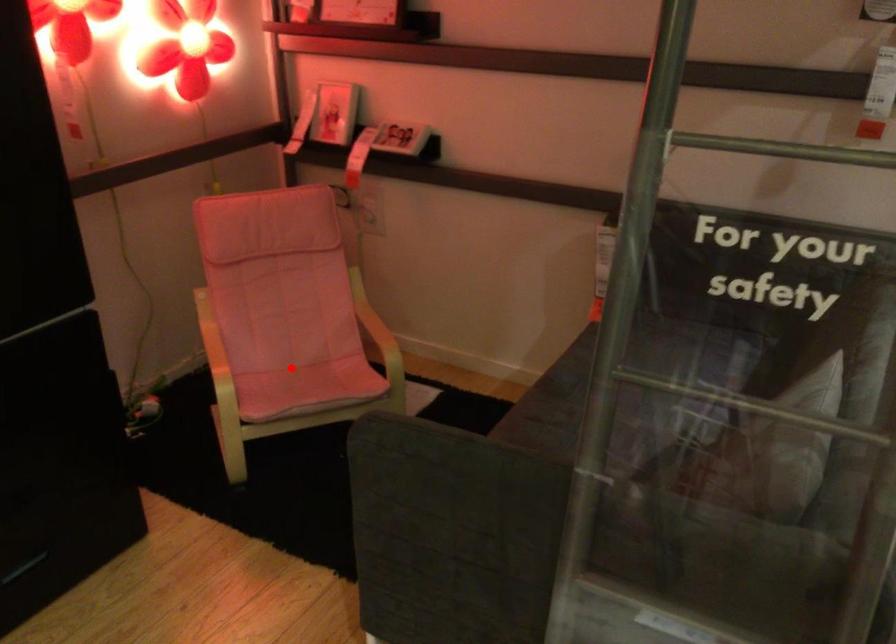
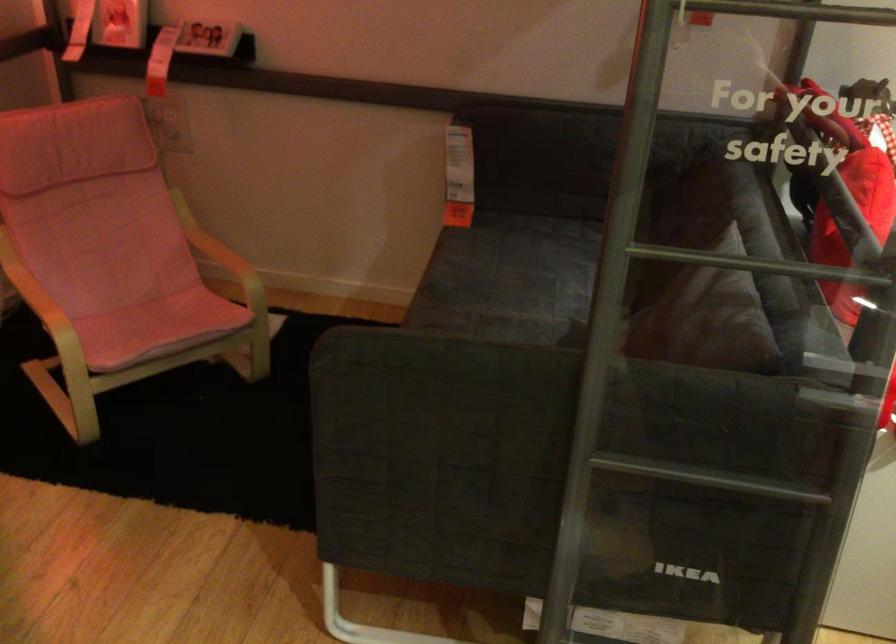
Where in the second image is the point corresponding to the highlighted location from the first image?

(126, 307)